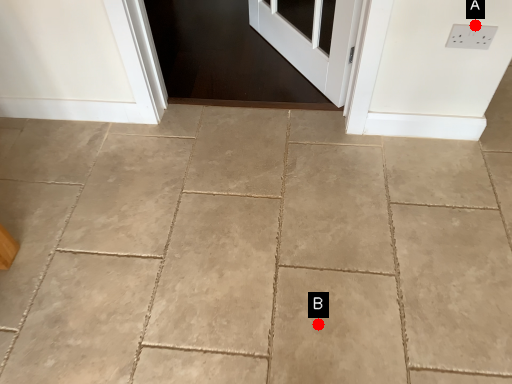
Question: Two points are circled on the image, labeled by A and B beside each circle. Which point is farther to the camera?

Choices:
 (A) A is further
 (B) B is further

Answer: (A)